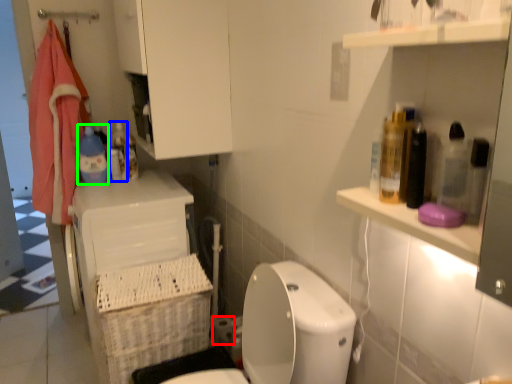
Question: Which object is positioned farthest from toilet paper (highlighted by a red box)? Select from bottle (highlighted by a blue box) and cleaning product (highlighted by a green box).

Choices:
 (A) bottle
 (B) cleaning product

Answer: (B)